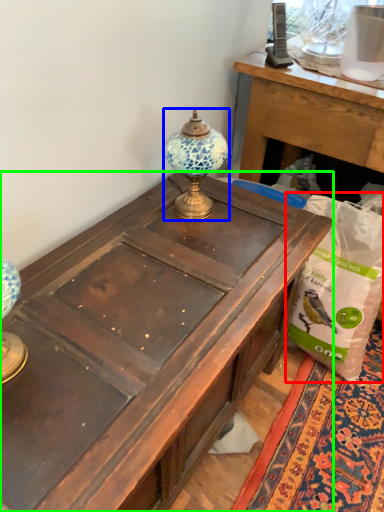
Question: Which object is the farthest from paper bag (highlighted by a red box)? Choose among these: lamp (highlighted by a blue box) or desk (highlighted by a green box).

Choices:
 (A) lamp
 (B) desk

Answer: (A)